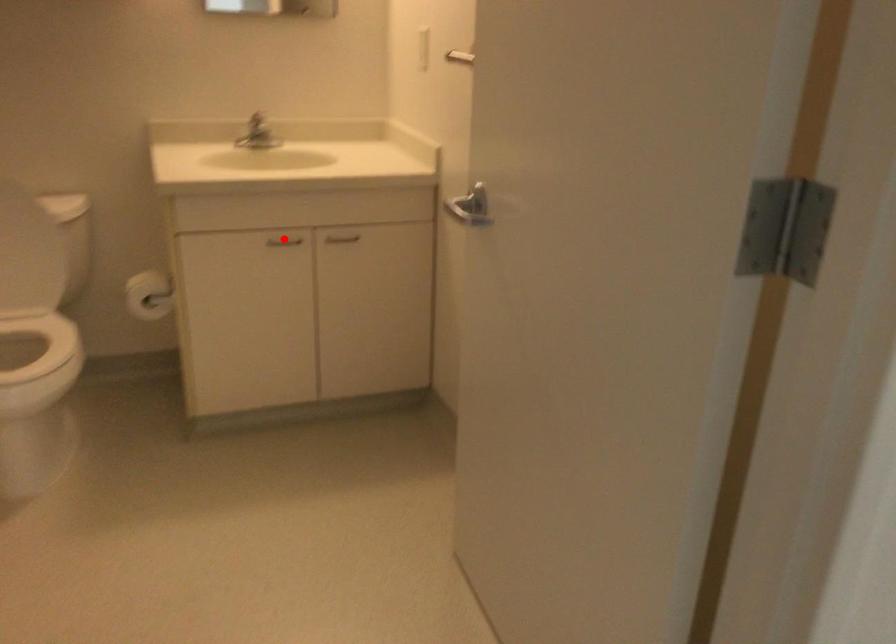
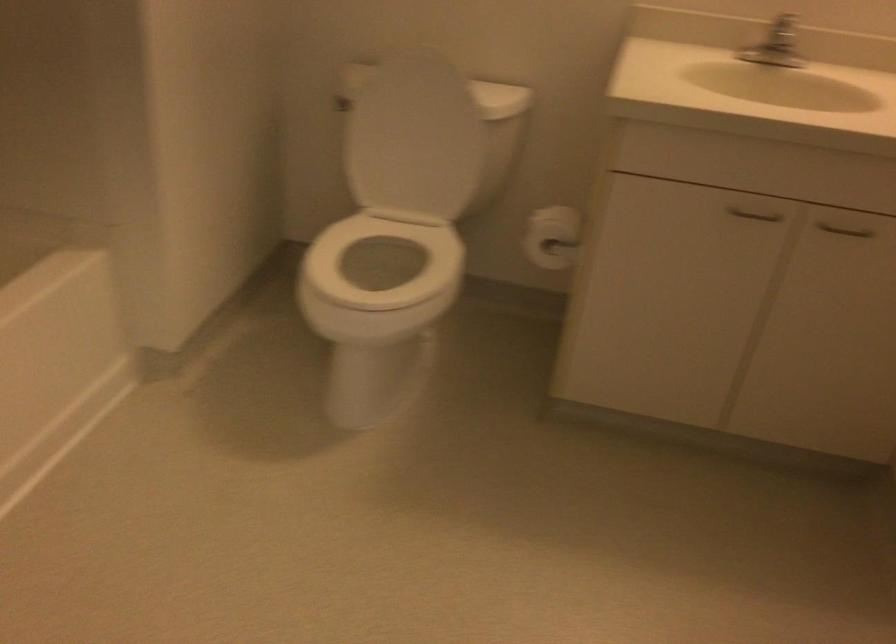
Question: I am providing you with two images of the same scene from different viewpoints. A red point is shown in image1. For the corresponding object point in image2, is it positioned nearer or farther from the camera?

Choices:
 (A) Nearer
 (B) Farther

Answer: (A)